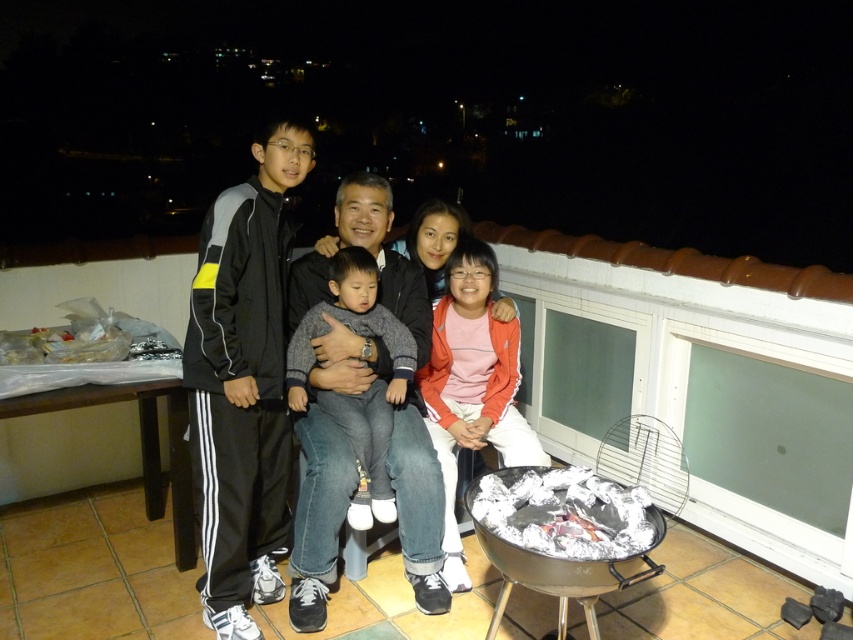
Question: Is black athletic suit at left further to the viewer compared to orange fleece jacket at center?

Choices:
 (A) yes
 (B) no

Answer: (B)

Question: Which object appears farthest from the camera in this image?

Choices:
 (A) gray soft sweater at center
 (B) dark blue jeans at center
 (C) matte black jacket at center

Answer: (A)

Question: Which point is closer to the camera?

Choices:
 (A) (270, 374)
 (B) (488, 388)
 (C) (398, 326)

Answer: (A)

Question: Which of these objects is positioned closest to the dark blue jeans at center?

Choices:
 (A) orange fleece jacket at center
 (B) gray soft sweater at center

Answer: (B)

Question: Can you confirm if matte black jacket at center is bigger than dark blue jeans at center?

Choices:
 (A) no
 (B) yes

Answer: (B)

Question: Is the position of dark blue jeans at center less distant than that of gray soft sweater at center?

Choices:
 (A) yes
 (B) no

Answer: (A)